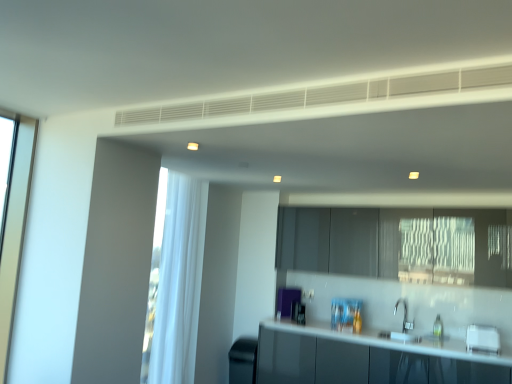
Question: From a real-world perspective, is glossy white countertop at lower center beneath white glossy toaster at lower right, acting as the 1th appliance starting from the right?

Choices:
 (A) yes
 (B) no

Answer: (A)

Question: Is glossy white countertop at lower center aimed at white glossy toaster at lower right, the first appliance in the front-to-back sequence?

Choices:
 (A) yes
 (B) no

Answer: (B)

Question: Is glossy white countertop at lower center shorter than white glossy toaster at lower right, acting as the 1th appliance starting from the right?

Choices:
 (A) no
 (B) yes

Answer: (A)

Question: Would you say white glossy toaster at lower right, the second appliance from the back, is part of glossy white countertop at lower center's contents?

Choices:
 (A) yes
 (B) no

Answer: (B)

Question: From the image's perspective, is glossy white countertop at lower center above white glossy toaster at lower right, acting as the 1th appliance starting from the right?

Choices:
 (A) no
 (B) yes

Answer: (A)

Question: Would you say black matte trash can at lower left, which is the second appliance from front to back, is to the left or to the right of glossy white countertop at lower center in the picture?

Choices:
 (A) right
 (B) left

Answer: (B)

Question: From a real-world perspective, is black matte trash can at lower left, which is the second appliance from front to back, positioned above or below glossy white countertop at lower center?

Choices:
 (A) below
 (B) above

Answer: (A)

Question: Is black matte trash can at lower left, which is counted as the first appliance, starting from the bottom, taller or shorter than glossy white countertop at lower center?

Choices:
 (A) short
 (B) tall

Answer: (A)

Question: Is black matte trash can at lower left, placed as the 2th appliance when sorted from top to bottom, inside or outside of glossy white countertop at lower center?

Choices:
 (A) outside
 (B) inside

Answer: (A)

Question: Is point (449, 354) positioned closer to the camera than point (232, 362)?

Choices:
 (A) farther
 (B) closer

Answer: (B)

Question: Is glossy white countertop at lower center wider or thinner than black matte trash can at lower left, placed as the 2th appliance when sorted from top to bottom?

Choices:
 (A) thin
 (B) wide

Answer: (B)

Question: Is glossy white countertop at lower center bigger or smaller than black matte trash can at lower left, placed as the 2th appliance when sorted from top to bottom?

Choices:
 (A) big
 (B) small

Answer: (A)

Question: From a real-world perspective, relative to black matte trash can at lower left, which ranks as the first appliance in back-to-front order, is glossy white countertop at lower center vertically above or below?

Choices:
 (A) below
 (B) above

Answer: (B)

Question: Looking at their shapes, would you say glossy white countertop at lower center is wider or thinner than white matte exhaust hood at upper center?

Choices:
 (A) thin
 (B) wide

Answer: (B)

Question: Based on their sizes in the image, would you say glossy white countertop at lower center is bigger or smaller than white matte exhaust hood at upper center?

Choices:
 (A) small
 (B) big

Answer: (B)